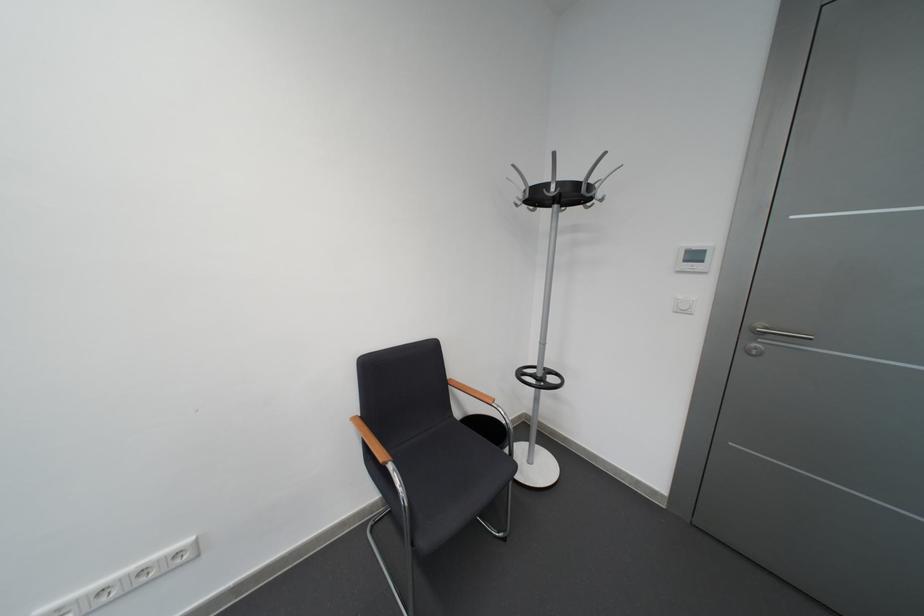
Find where to placing through the umbrella holder ring. Please return your answer as a coordinate pair (x, y).

(540, 378)